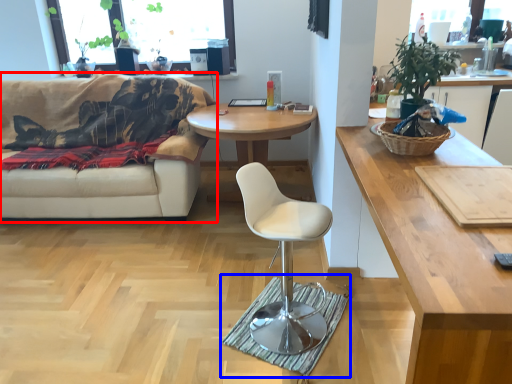
Question: Which of the following is the closest to the observer, studio couch (highlighted by a red box) or mat (highlighted by a blue box)?

Choices:
 (A) studio couch
 (B) mat

Answer: (B)